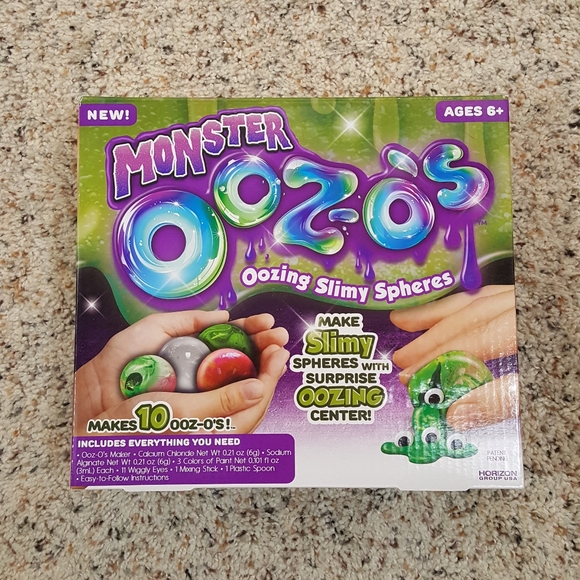
The width and height of the screenshot is (580, 580). Find the location of `carpet`. carpet is located at coordinates (553, 75).